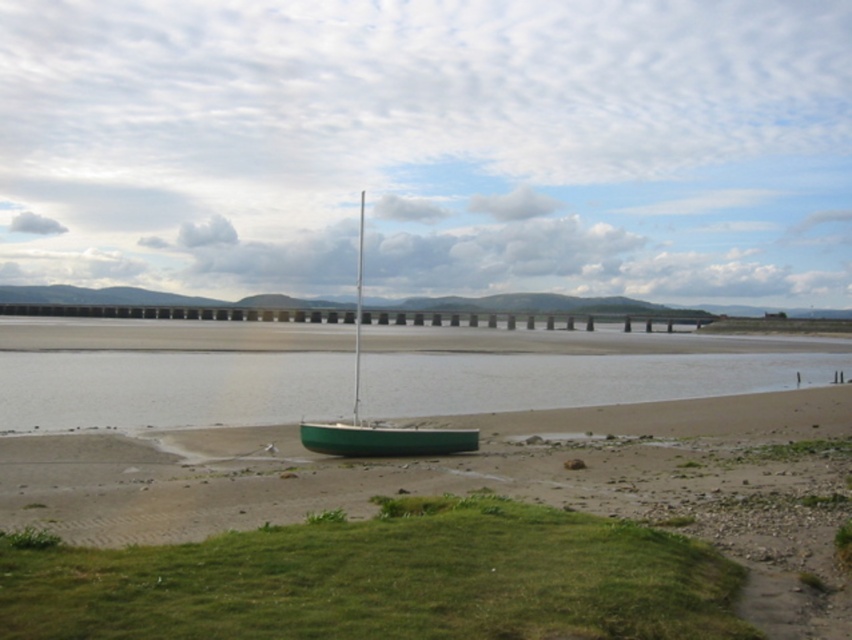
Is green matte sailboat at center shorter than green matte canoe at center?

No, green matte sailboat at center is not shorter than green matte canoe at center.

Find the location of a particular element. The width and height of the screenshot is (852, 640). green matte sailboat at center is located at coordinates (378, 426).

Identify the location of green matte sailboat at center. This screenshot has height=640, width=852. (378, 426).